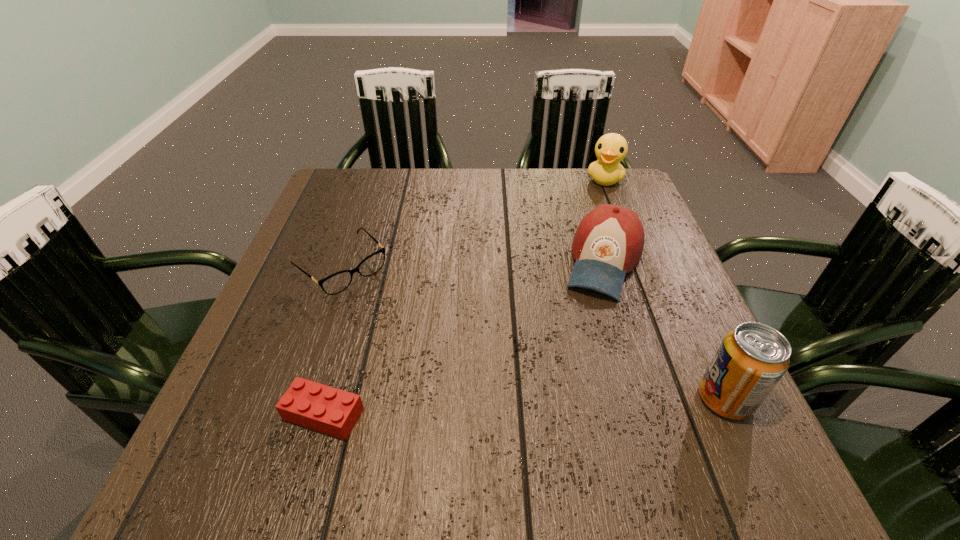
The image size is (960, 540). Find the location of `vacant region located 0.140m on the front-facing side of the spectacles`. vacant region located 0.140m on the front-facing side of the spectacles is located at coordinates (405, 327).

You are a GUI agent. You are given a task and a screenshot of the screen. Output one action in this format:
    pyautogui.click(x=<x>, y=<y>)
    Task: Click on the free space located 0.200m on the front-facing side of the spectacles
    
    Given the screenshot: What is the action you would take?
    pyautogui.click(x=423, y=345)

You are a GUI agent. You are given a task and a screenshot of the screen. Output one action in this format:
    pyautogui.click(x=<x>, y=<y>)
    Task: Click on the free point located 0.210m on the front-facing side of the spectacles
    
    Given the screenshot: What is the action you would take?
    pyautogui.click(x=426, y=347)

You are a GUI agent. You are given a task and a screenshot of the screen. Output one action in this format:
    pyautogui.click(x=<x>, y=<y>)
    Task: Click on the free space located on the face of the duck
    The image size is (960, 540).
    Given the screenshot: What is the action you would take?
    pyautogui.click(x=590, y=226)

Image resolution: width=960 pixels, height=540 pixels. Find the location of `vacant point located on the face of the duck`. vacant point located on the face of the duck is located at coordinates (588, 235).

The width and height of the screenshot is (960, 540). What are the coordinates of `free space located on the face of the duck` in the screenshot? It's located at point(577,267).

At what (x,y) coordinates should I click in order to perform the action: click on object that is at the far edge. Please return your answer as a coordinate pair (x, y). Looking at the image, I should click on (611, 149).

Where is `Lego present at the near edge`? The image size is (960, 540). Lego present at the near edge is located at coordinates (322, 408).

You are a GUI agent. You are given a task and a screenshot of the screen. Output one action in this format:
    pyautogui.click(x=<x>, y=<y>)
    Task: Click on the soda can that is positioned at the near edge
    The width and height of the screenshot is (960, 540).
    Given the screenshot: What is the action you would take?
    pyautogui.click(x=752, y=358)

Locate an element on the screen. Lego present at the left edge is located at coordinates (322, 408).